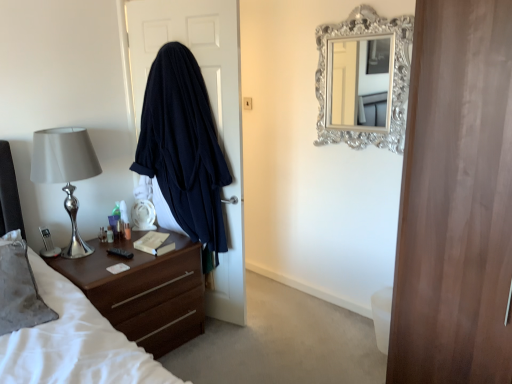
In order to click on free space that is in between black plastic remote control at left and translucent plastic bottle at left, which appears as the 2th bottle when viewed from the left in this screenshot , I will do `click(115, 253)`.